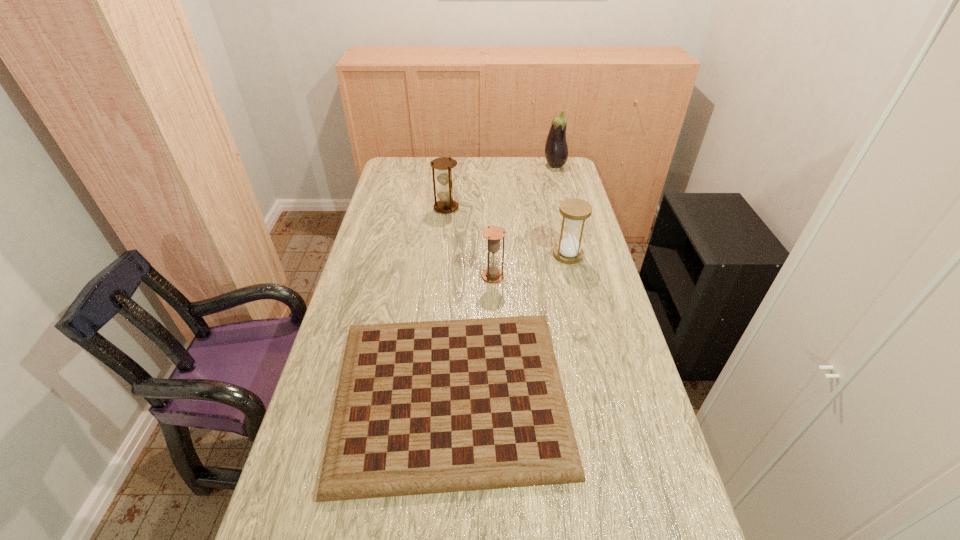
The height and width of the screenshot is (540, 960). I want to click on vacant space positioned on the front of the tallest object, so click(559, 179).

Find the location of a particular element. Image resolution: width=960 pixels, height=540 pixels. vacant region located on the back of the leftmost hourglass is located at coordinates (448, 186).

I want to click on vacant region located 0.300m on the back of the rightmost hourglass, so click(x=555, y=200).

The image size is (960, 540). Find the location of `vacant space located on the front of the second nearest object`. vacant space located on the front of the second nearest object is located at coordinates tap(495, 359).

Where is `vacant area situated on the back of the shortest object`? vacant area situated on the back of the shortest object is located at coordinates (460, 239).

At what (x,y) coordinates should I click in order to perform the action: click on object situated at the far edge. Please return your answer as a coordinate pair (x, y). Looking at the image, I should click on (556, 150).

What are the coordinates of `object that is positioned at the left edge` in the screenshot? It's located at (428, 407).

Locate an element on the screen. Image resolution: width=960 pixels, height=540 pixels. eggplant situated at the right edge is located at coordinates (556, 150).

Locate an element on the screen. hourglass located at the right edge is located at coordinates (575, 211).

This screenshot has width=960, height=540. I want to click on object that is at the far right corner, so click(556, 150).